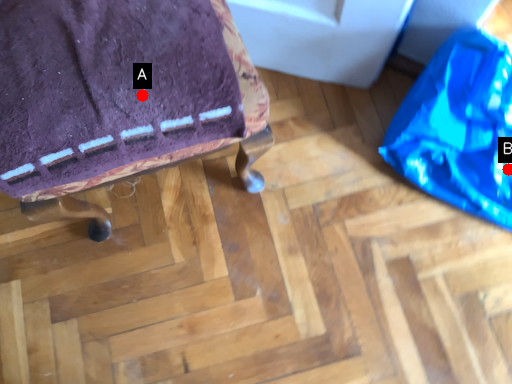
Question: Two points are circled on the image, labeled by A and B beside each circle. Among these points, which one is farthest from the camera?

Choices:
 (A) A is further
 (B) B is further

Answer: (B)